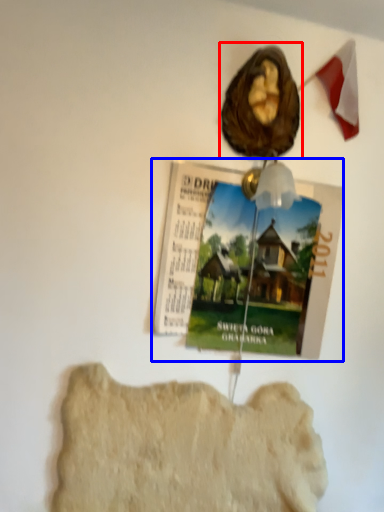
Question: Which object appears farthest to the camera in this image, art (highlighted by a red box) or magazine (highlighted by a blue box)?

Choices:
 (A) art
 (B) magazine

Answer: (B)